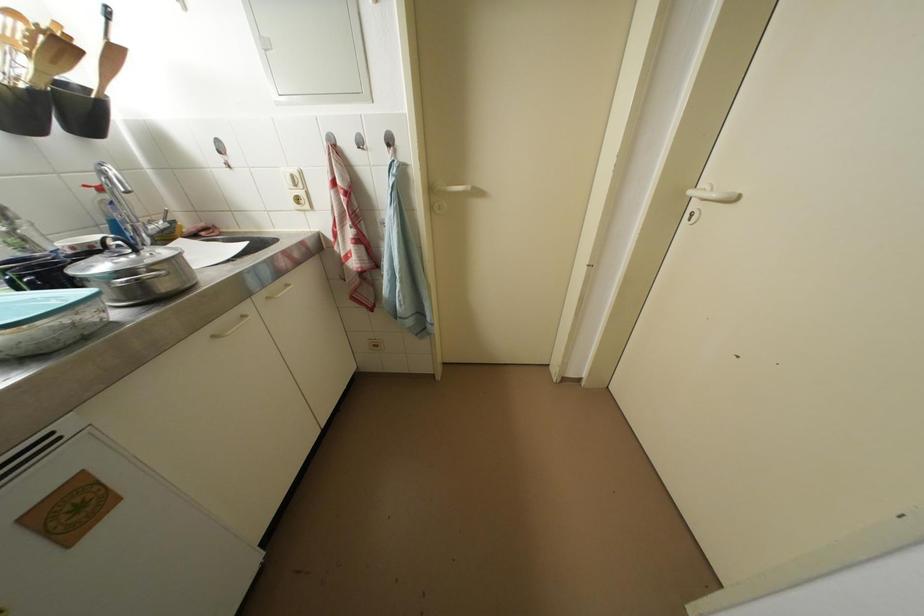
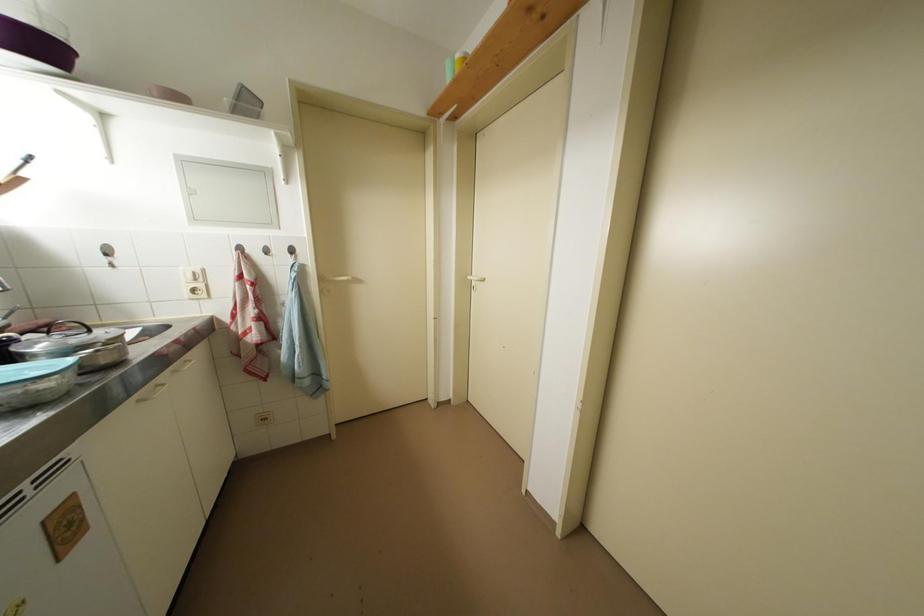
The point at (299, 180) is marked in the first image. Where is the corresponding point in the second image?

(201, 277)